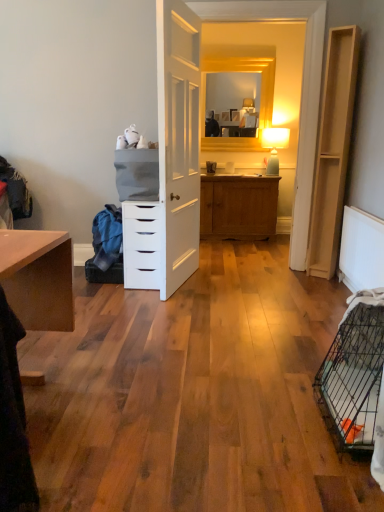
Question: Is white textured radiator at lower right a part of blue fabric at left?

Choices:
 (A) no
 (B) yes

Answer: (A)

Question: Can you confirm if blue fabric at left is wider than white textured radiator at lower right?

Choices:
 (A) no
 (B) yes

Answer: (B)

Question: Is blue fabric at left not inside white textured radiator at lower right?

Choices:
 (A) yes
 (B) no

Answer: (A)

Question: From a real-world perspective, is blue fabric at left positioned under white textured radiator at lower right based on gravity?

Choices:
 (A) yes
 (B) no

Answer: (A)

Question: Can you confirm if blue fabric at left is positioned to the left of white textured radiator at lower right?

Choices:
 (A) yes
 (B) no

Answer: (A)

Question: From the image's perspective, would you say blue fabric at left is positioned over white textured radiator at lower right?

Choices:
 (A) yes
 (B) no

Answer: (A)

Question: Is black wire birdcage at lower right shorter than blue fabric at left?

Choices:
 (A) no
 (B) yes

Answer: (A)

Question: From a real-world perspective, is black wire birdcage at lower right on top of blue fabric at left?

Choices:
 (A) no
 (B) yes

Answer: (A)

Question: Is black wire birdcage at lower right beside blue fabric at left?

Choices:
 (A) yes
 (B) no

Answer: (B)

Question: Can blue fabric at left be found inside black wire birdcage at lower right?

Choices:
 (A) yes
 (B) no

Answer: (B)

Question: Is black wire birdcage at lower right further to the viewer compared to blue fabric at left?

Choices:
 (A) no
 (B) yes

Answer: (A)

Question: Is black wire birdcage at lower right completely or partially outside of blue fabric at left?

Choices:
 (A) yes
 (B) no

Answer: (A)

Question: Is blue fabric at left far from white matte chest of drawers at center?

Choices:
 (A) no
 (B) yes

Answer: (A)